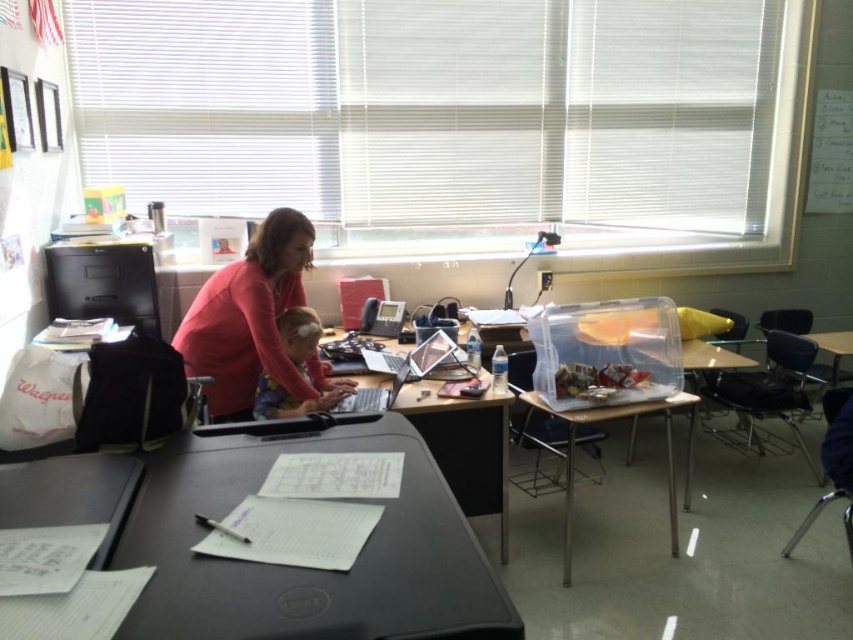
You are standing at the point with coordinates point (273, 316) and want to walk to the point with coordinates point (262, 570). Which direction should you move to reach your destination?

You should move forward because point (262, 570) is in front of point (273, 316).

You are a student who needs to place a textbook on the desk. Given that the textbook is the same size as the matte pink sweater at center, will it fit on the black plastic table at center?

The black plastic table at center has a width larger than the matte pink sweater at center, so the textbook, being the same size as the sweater, will fit on the table.

You are a student trying to place a heavy textbook on the desk. The black plastic table at center and the matte pink sweater at center are both on the desk. Which object should you avoid placing the textbook on top of to prevent damaging the sweater?

The matte pink sweater at center is under the black plastic table at center, so placing the textbook on the sweater would require moving the table first.